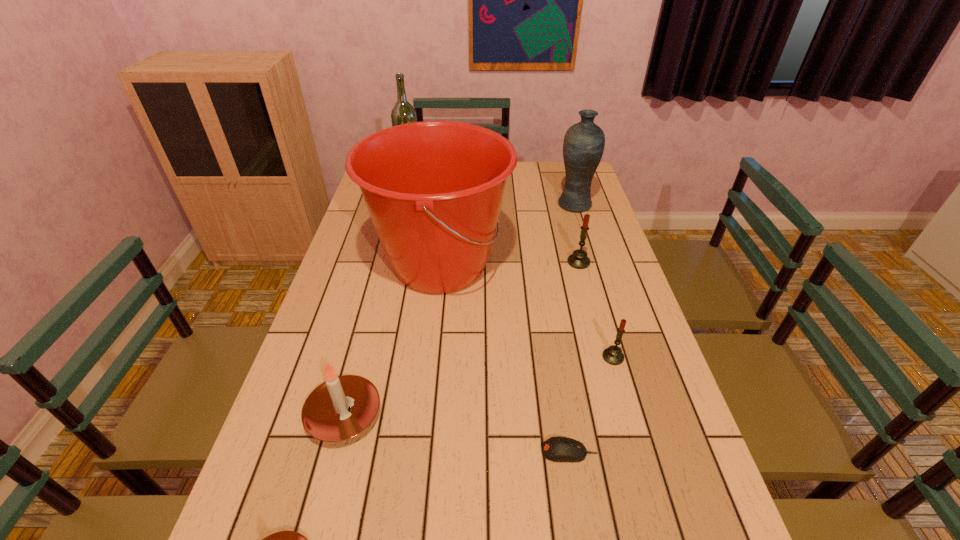
I want to click on candle that stands as the closest to the fourth object from right to left, so click(613, 355).

The height and width of the screenshot is (540, 960). Find the location of `vacant position in the image that satisfies the following two spatial constraints: 1. on the front side of the seventh nearest object; 2. with the handle attached to the rim of the bucket`. vacant position in the image that satisfies the following two spatial constraints: 1. on the front side of the seventh nearest object; 2. with the handle attached to the rim of the bucket is located at coordinates (593, 266).

Locate an element on the screen. free space that satisfies the following two spatial constraints: 1. on the back side of the smaller red candle; 2. on the left side of the bigger white candle is located at coordinates (359, 357).

This screenshot has width=960, height=540. What are the coordinates of `free space that satisfies the following two spatial constraints: 1. on the back side of the farthest object; 2. on the right side of the second nearest candle` in the screenshot? It's located at (405, 178).